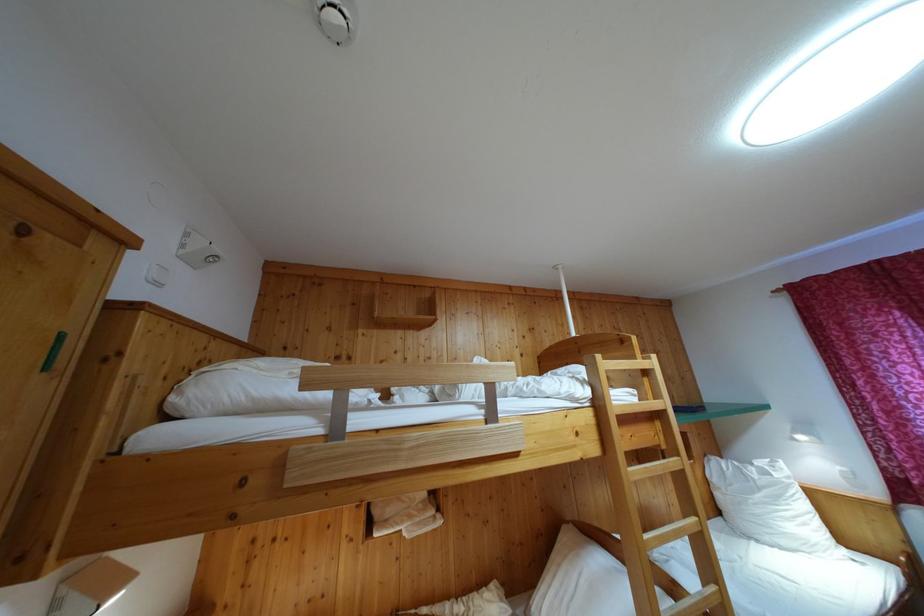
Describe the element at coordinates (54, 352) in the screenshot. I see `the green cabinet handle` at that location.